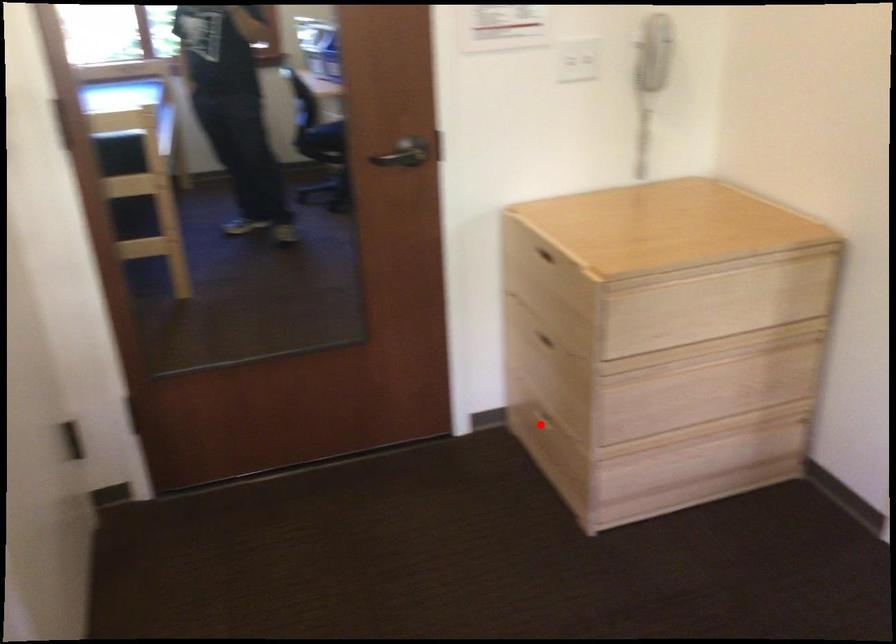
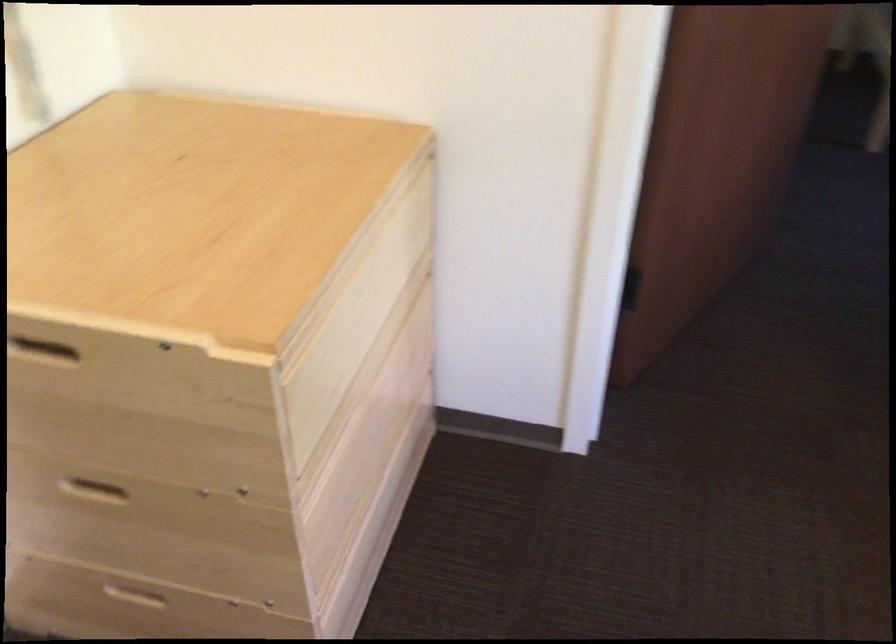
Question: I am providing you with two images of the same scene from different viewpoints. Image1 has a red point marked. In image2, the corresponding 3D location appears at what relative position? Reply with the corresponding letter.

Choices:
 (A) Closer
 (B) Farther

Answer: (A)